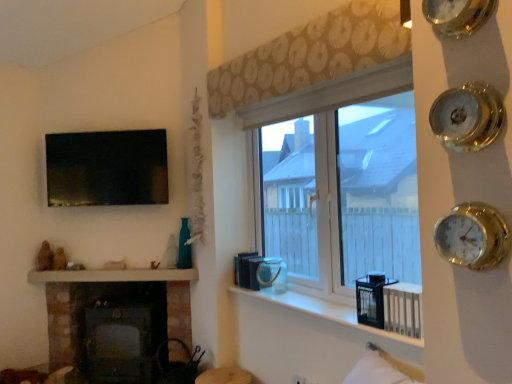
Question: Is white glossy mantle at lower left oriented away from beige patterned curtain at upper center?

Choices:
 (A) yes
 (B) no

Answer: (B)

Question: Does white glossy mantle at lower left lie in front of beige patterned curtain at upper center?

Choices:
 (A) no
 (B) yes

Answer: (A)

Question: Is white glossy mantle at lower left outside beige patterned curtain at upper center?

Choices:
 (A) yes
 (B) no

Answer: (A)

Question: Is white glossy mantle at lower left directly adjacent to beige patterned curtain at upper center?

Choices:
 (A) no
 (B) yes

Answer: (A)

Question: Is white glossy mantle at lower left far from beige patterned curtain at upper center?

Choices:
 (A) no
 (B) yes

Answer: (B)

Question: From a real-world perspective, is beige patterned curtain at upper center positioned above or below dark gray metal wood burning stove at lower left?

Choices:
 (A) below
 (B) above

Answer: (B)

Question: Is beige patterned curtain at upper center taller or shorter than dark gray metal wood burning stove at lower left?

Choices:
 (A) short
 (B) tall

Answer: (A)

Question: Relative to dark gray metal wood burning stove at lower left, is beige patterned curtain at upper center in front or behind?

Choices:
 (A) front
 (B) behind

Answer: (A)

Question: Is beige patterned curtain at upper center wider or thinner than dark gray metal wood burning stove at lower left?

Choices:
 (A) wide
 (B) thin

Answer: (B)

Question: Relative to white glossy mantle at lower left, is matte brown vase at lower center in front or behind?

Choices:
 (A) behind
 (B) front

Answer: (B)

Question: Based on their sizes in the image, would you say matte brown vase at lower center is bigger or smaller than white glossy mantle at lower left?

Choices:
 (A) small
 (B) big

Answer: (B)

Question: Would you say matte brown vase at lower center is inside or outside white glossy mantle at lower left?

Choices:
 (A) outside
 (B) inside

Answer: (A)

Question: From a real-world perspective, is matte brown vase at lower center positioned above or below white glossy mantle at lower left?

Choices:
 (A) above
 (B) below

Answer: (B)

Question: Is dark gray metal wood burning stove at lower left inside the boundaries of beige patterned curtain at upper center, or outside?

Choices:
 (A) outside
 (B) inside

Answer: (A)

Question: In terms of size, does dark gray metal wood burning stove at lower left appear bigger or smaller than beige patterned curtain at upper center?

Choices:
 (A) big
 (B) small

Answer: (A)